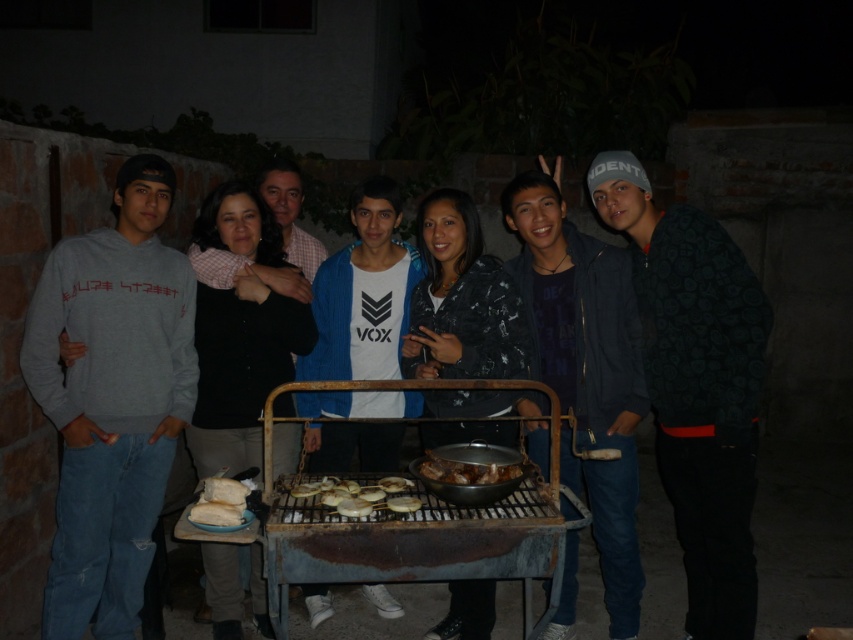
Looking at this image, you are at a nighttime gathering and want to grab the golden crispy chips at center without touching the dark blue jacket at center. Is this possible?

The dark blue jacket at center is positioned over golden crispy chips at center, so you cannot reach the chips without moving the jacket first.

You are standing in the middle of the backyard and want to locate the dark blue jacket at center. Based on the coordinates provided, in which direction should you move to find it?

The dark blue jacket at center is located at coordinates point (x=585, y=371). Since you are standing in the middle of the backyard, you should move towards the direction of the coordinates to find it.

You are a photographer standing at the scene. You want to take a photo of the dark blue jacket at center without any people in the foreground. Can you step back enough to do so?

The dark blue jacket at center and viewer are 8.67 feet apart from each other. If you step back, you might be able to frame the photo so that no people are in the foreground, but the exact feasibility depends on the arrangement of the group and the camera lens used. However, based on the given distance, stepping back 8.67 feet or more could potentially allow you to capture the jacket without foreground obstruction.